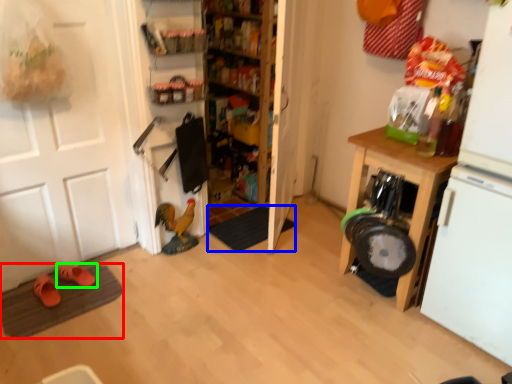
Question: Estimate the real-world distances between objects in this image. Which object is farther from doormat (highlighted by a red box), doormat (highlighted by a blue box) or footwear (highlighted by a green box)?

Choices:
 (A) doormat
 (B) footwear

Answer: (A)